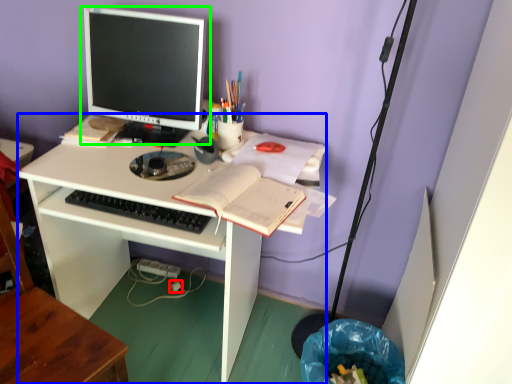
Question: Based on their relative distances, which object is farther from power plugs and sockets (highlighted by a red box)? Choose from desk (highlighted by a blue box) and computer monitor (highlighted by a green box).

Choices:
 (A) desk
 (B) computer monitor

Answer: (B)